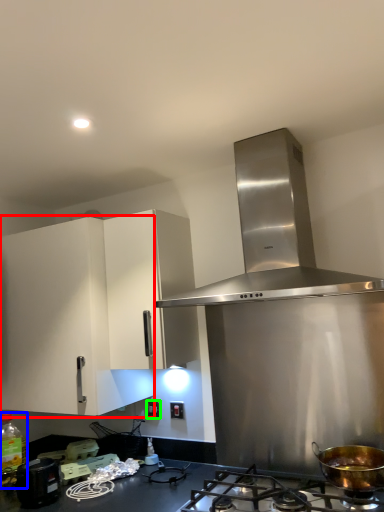
Question: Considering the real-world distances, which object is farthest from cabinetry (highlighted by a red box)? bottle (highlighted by a blue box) or electric outlet (highlighted by a green box)?

Choices:
 (A) bottle
 (B) electric outlet

Answer: (B)